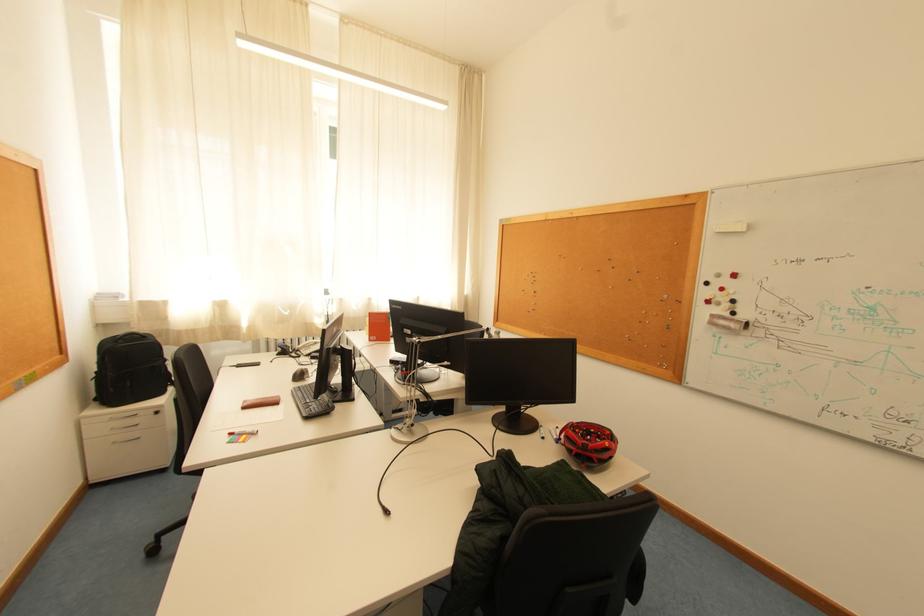
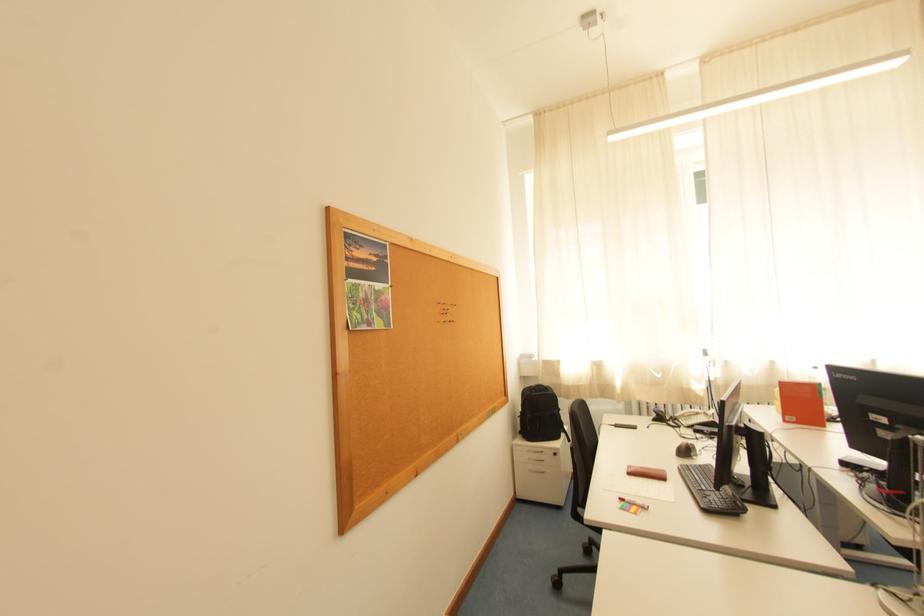
Find the pixel in the second image that matches point (348, 394) in the first image.

(759, 492)